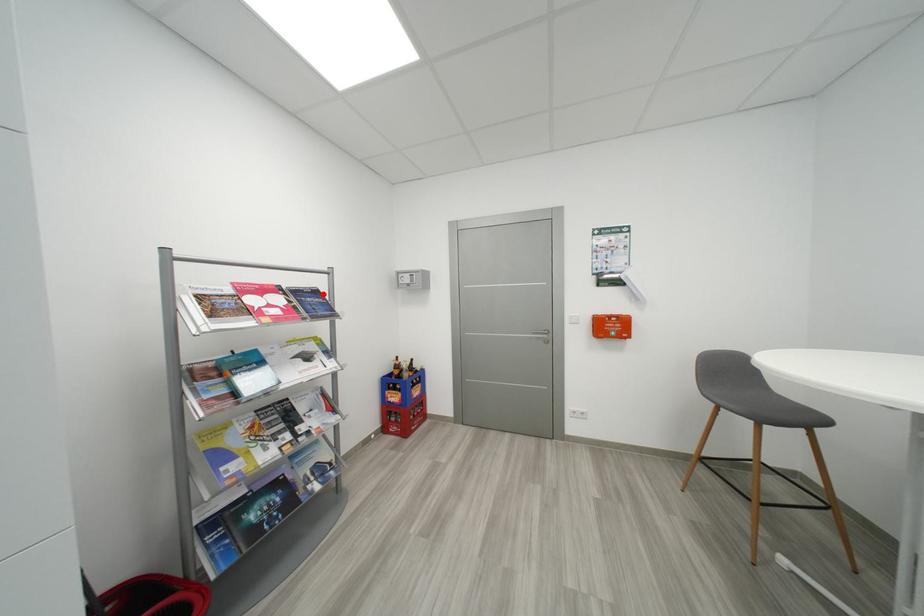
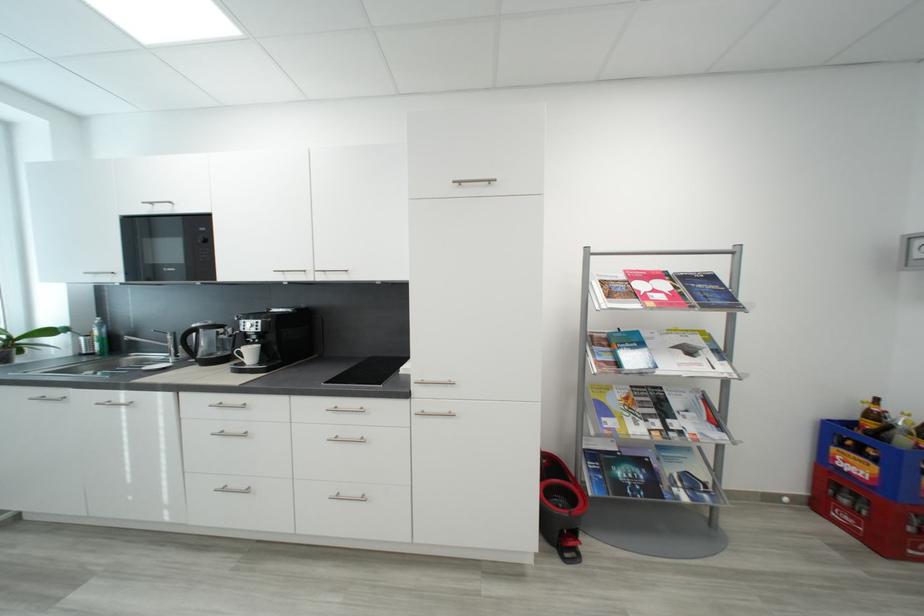
In the second image, find the point that corresponds to the highlighted location in the first image.

(718, 280)